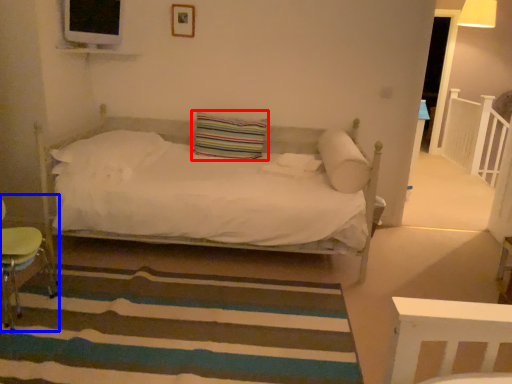
Question: Which of the following is the farthest to the observer, pillow (highlighted by a red box) or swivel chair (highlighted by a blue box)?

Choices:
 (A) pillow
 (B) swivel chair

Answer: (A)